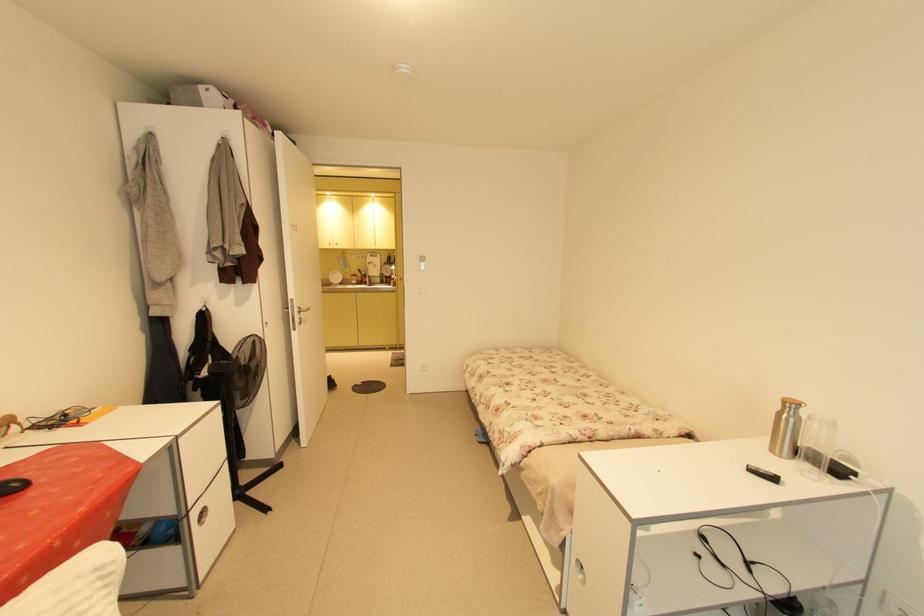
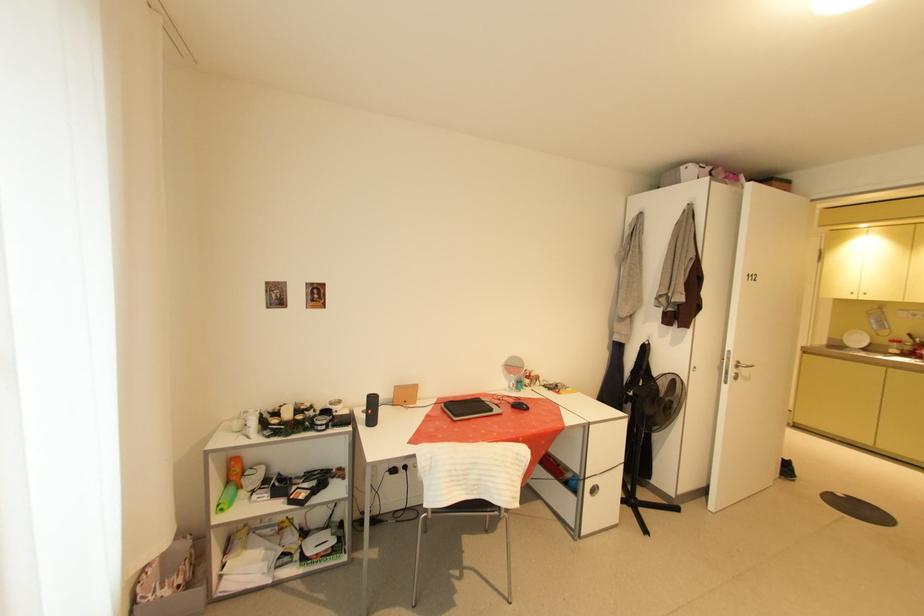
Question: Based on the continuous images, in which direction is the camera rotating? Reply with the corresponding letter.

Choices:
 (A) Left
 (B) Right
 (C) Up
 (D) Down

Answer: (A)